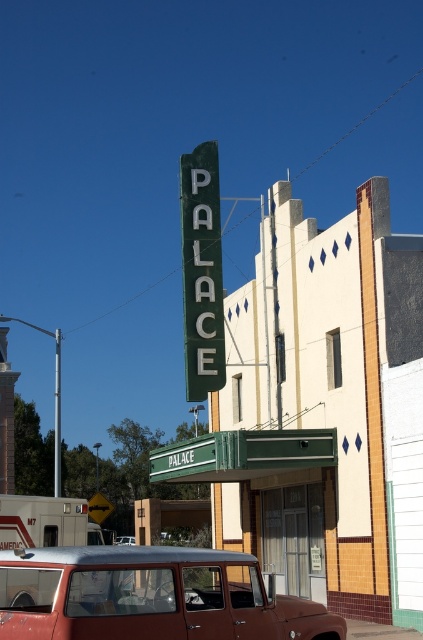
Question: Which point appears farthest from the camera in this image?

Choices:
 (A) (216, 273)
 (B) (7, 625)

Answer: (A)

Question: Is rustic metal station wagon at center to the right of green metallic sign at upper center from the viewer's perspective?

Choices:
 (A) no
 (B) yes

Answer: (B)

Question: Among these objects, which one is nearest to the camera?

Choices:
 (A) green metallic sign at upper center
 (B) rustic metal station wagon at center

Answer: (B)

Question: Which object is farther from the camera taking this photo?

Choices:
 (A) green metallic sign at upper center
 (B) rustic metal station wagon at center

Answer: (A)

Question: Can you confirm if rustic metal station wagon at center is bigger than green metallic sign at upper center?

Choices:
 (A) yes
 (B) no

Answer: (B)

Question: From the image, what is the correct spatial relationship of rustic metal station wagon at center in relation to green metallic sign at upper center?

Choices:
 (A) above
 (B) below

Answer: (B)